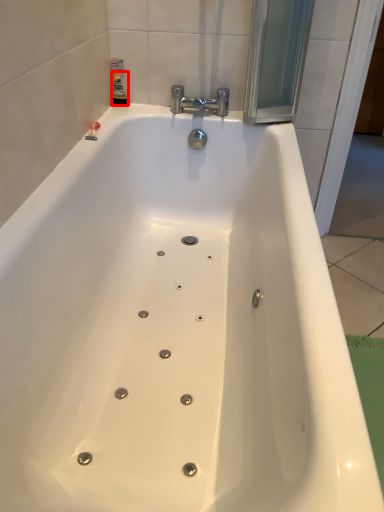
Question: Considering the relative positions of toiletry (annotated by the red box) and tap in the image provided, where is toiletry (annotated by the red box) located with respect to the staircase?

Choices:
 (A) left
 (B) right

Answer: (A)